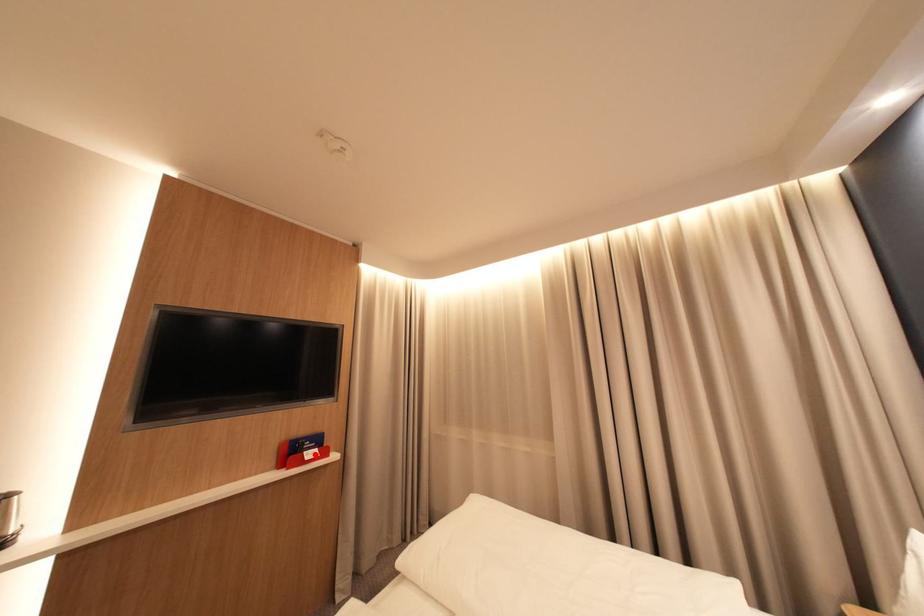
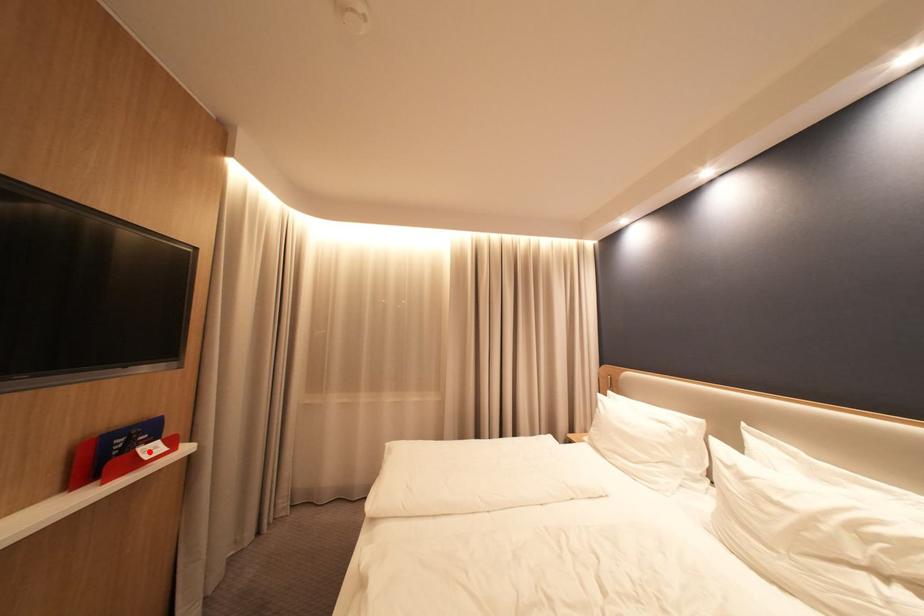
I am providing you with two images of the same scene from different viewpoints. A red point is marked on the first image and another point is marked on the second image. Does the point marked in image1 correspond to the same location as the one in image2?

Yes